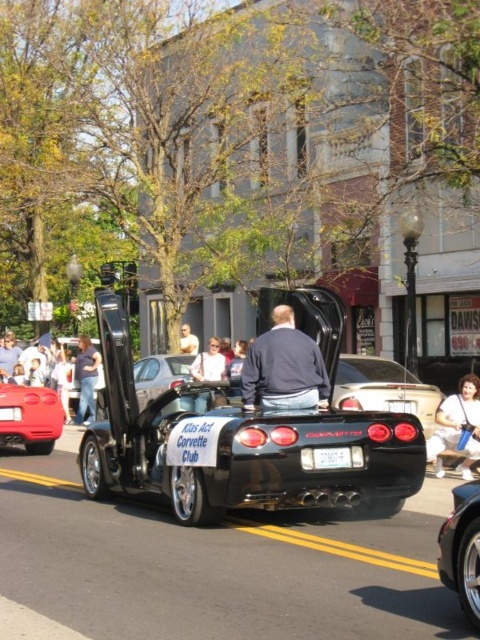
Is shiny black convertible at center positioned at the back of white plastic license plate at center?

No.

Is point (132, 392) farther from viewer compared to point (313, 451)?

Yes, it is.

Find the location of a particular element. shiny black convertible at center is located at coordinates (238, 445).

Between shiny black convertible at center and black glossy convertible at center, which one is positioned higher?

shiny black convertible at center is above.

Who is positioned more to the right, shiny black convertible at center or black glossy convertible at center?

black glossy convertible at center

Locate an element on the screen. The height and width of the screenshot is (640, 480). shiny black convertible at center is located at coordinates (238, 445).

Is glossy black car at center to the left of shiny silver car at center from the viewer's perspective?

Incorrect, glossy black car at center is not on the left side of shiny silver car at center.

Which is in front, point (434, 388) or point (152, 380)?

Positioned in front is point (434, 388).

Find the location of `glossy black car at center`. glossy black car at center is located at coordinates (384, 388).